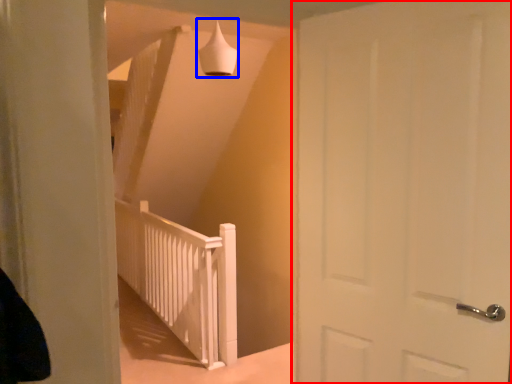
Question: Which of the following is the closest to the observer, door (highlighted by a red box) or lamp (highlighted by a blue box)?

Choices:
 (A) door
 (B) lamp

Answer: (A)